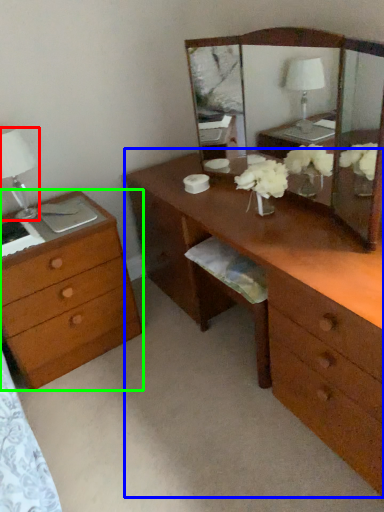
Question: Which object is the closest to the table lamp (highlighted by a red box)? Choose among these: desk (highlighted by a blue box) or chest of drawers (highlighted by a green box).

Choices:
 (A) desk
 (B) chest of drawers

Answer: (B)